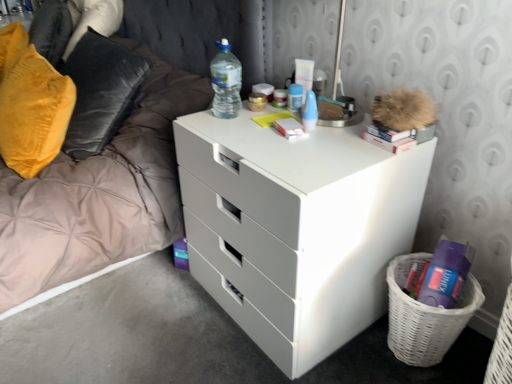
Where is `free spot to the left of white matte book at center, which ranks as the 1th book in left-to-right order`? free spot to the left of white matte book at center, which ranks as the 1th book in left-to-right order is located at coordinates (237, 133).